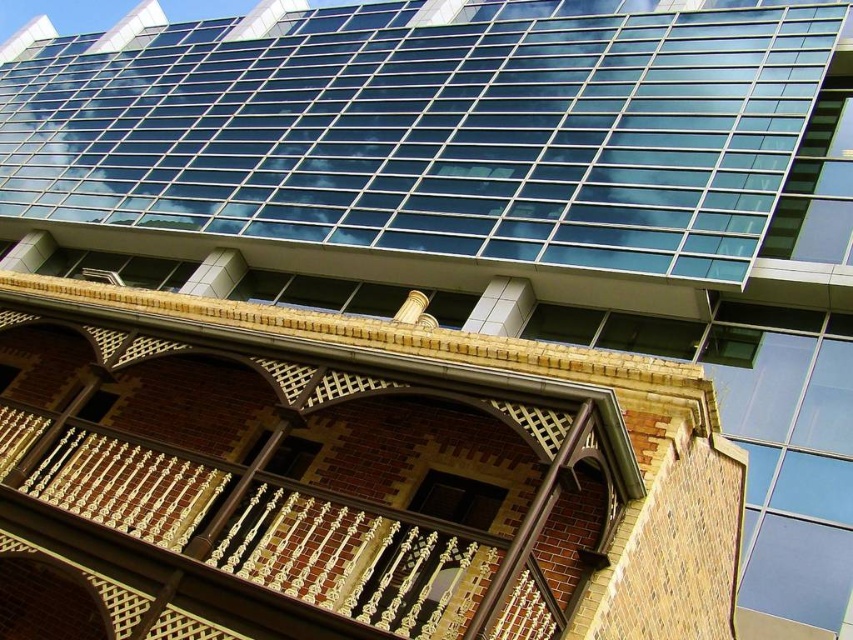
What do you see at coordinates (434, 132) in the screenshot?
I see `transparent glass windows at upper center` at bounding box center [434, 132].

From the picture: Is transparent glass windows at upper center positioned at the back of brown brick balcony at center?

Yes, it is.

Image resolution: width=853 pixels, height=640 pixels. Describe the element at coordinates (434, 132) in the screenshot. I see `transparent glass windows at upper center` at that location.

Identify the location of transparent glass windows at upper center. The image size is (853, 640). (434, 132).